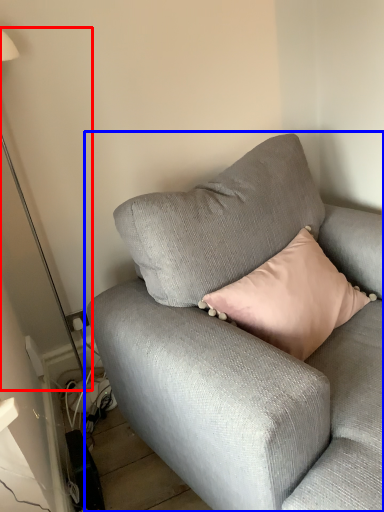
Question: Which point is closer to the camera, table lamp (highlighted by a red box) or studio couch (highlighted by a blue box)?

Choices:
 (A) table lamp
 (B) studio couch

Answer: (B)